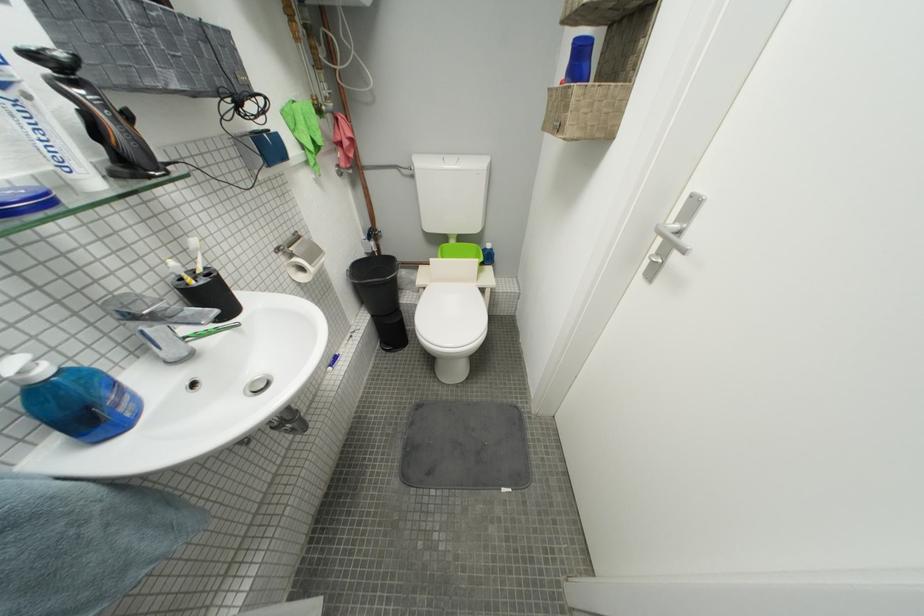
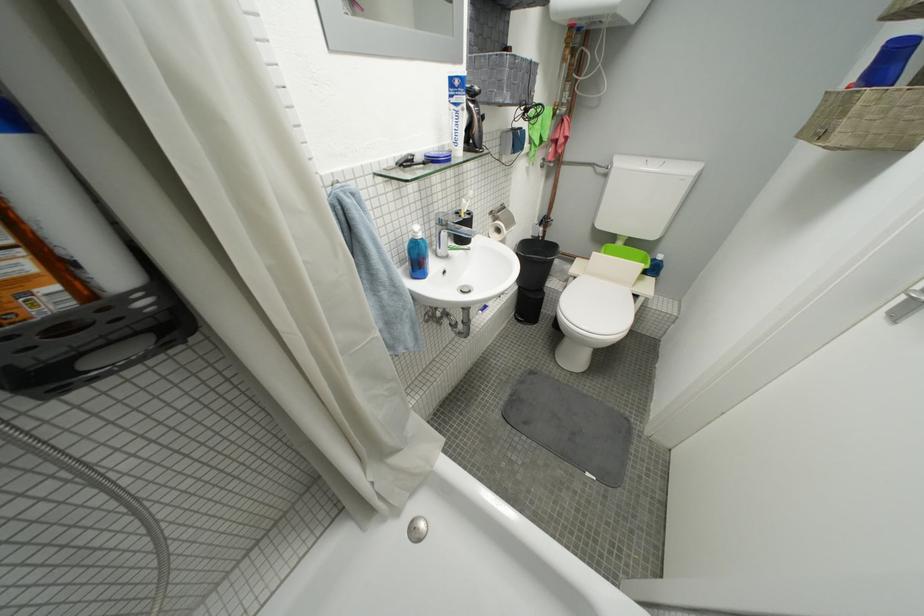
The point at (74, 169) is marked in the first image. Where is the corresponding point in the second image?

(465, 145)